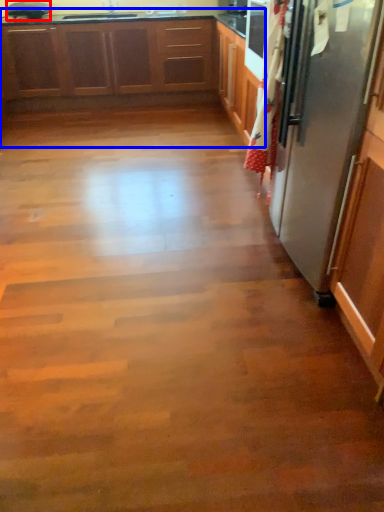
Question: Which of the following is the farthest to the observer, appliance (highlighted by a red box) or cabinetry (highlighted by a blue box)?

Choices:
 (A) appliance
 (B) cabinetry

Answer: (A)